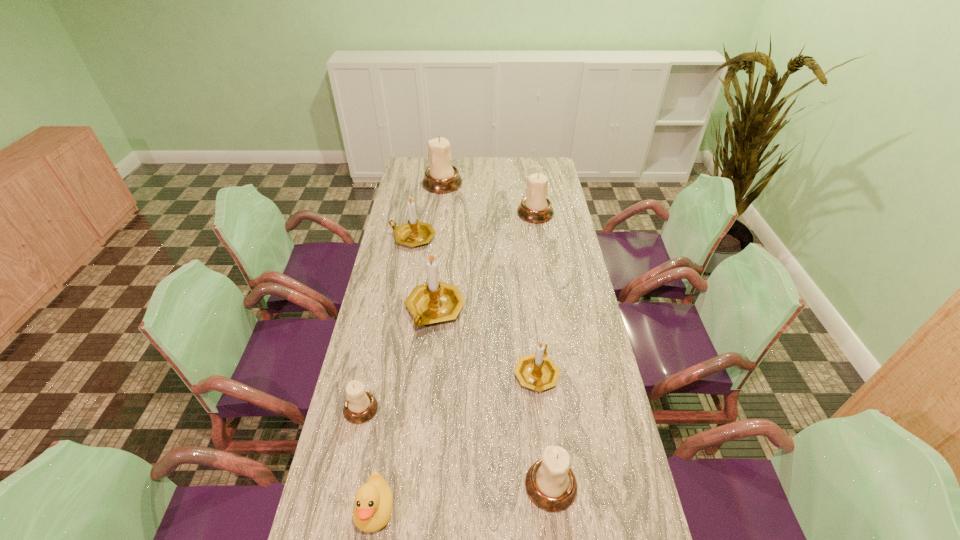
The image size is (960, 540). What are the coordinates of `the second white candle holder from left to right` in the screenshot? It's located at (441, 177).

Image resolution: width=960 pixels, height=540 pixels. I want to click on the biggest white candle holder, so click(x=441, y=177).

You are a GUI agent. You are given a task and a screenshot of the screen. Output one action in this format:
    pyautogui.click(x=<x>, y=<y>)
    Task: Click on the biggest gold candle holder
    The height and width of the screenshot is (540, 960).
    Given the screenshot: What is the action you would take?
    pyautogui.click(x=436, y=301)

The width and height of the screenshot is (960, 540). In order to click on the fourth farthest candle holder in this screenshot , I will do `click(436, 301)`.

I want to click on the second biggest white candle holder, so click(x=535, y=208).

This screenshot has height=540, width=960. What are the coordinates of `the sixth nearest candle holder` in the screenshot? It's located at (535, 208).

In order to click on the sixth nearest object in this screenshot , I will do `click(414, 233)`.

Locate an element on the screen. This screenshot has height=540, width=960. the farthest gold candle holder is located at coordinates (414, 233).

The image size is (960, 540). What are the coordinates of `the second smallest white candle holder` in the screenshot? It's located at (551, 485).

Locate an element on the screen. the nearest candle holder is located at coordinates (551, 485).